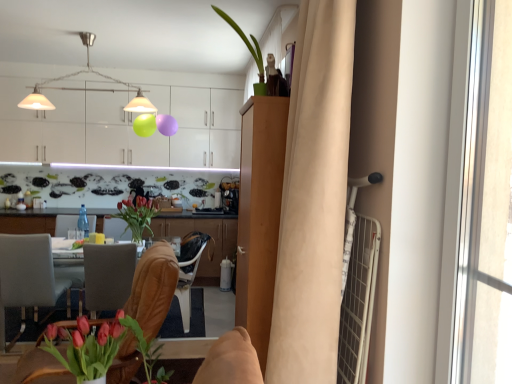
Find the location of a particular element. This screenshot has height=384, width=512. green matte plant at upper center is located at coordinates (250, 52).

What is the approximate height of matte glass vase at center, the 1th floral arrangement when ordered from back to front?

17.82 inches.

At what (x,y) coordinates should I click in order to perform the action: click on matte gray chair at lower left, the 2th chair in the front-to-back sequence. Please return your answer as a coordinate pair (x, y). Looking at the image, I should click on (28, 278).

Where is `leather at center, which is the first chair from front to back`? The image size is (512, 384). leather at center, which is the first chair from front to back is located at coordinates tap(153, 288).

Between point (38, 249) and point (148, 363), which one is positioned in front?

The point (148, 363) is more forward.

Who is smaller, matte gray chair at lower left, the 2th chair in the front-to-back sequence, or matte pink tulips in vase at lower left, the first floral arrangement positioned from the front?

matte pink tulips in vase at lower left, the first floral arrangement positioned from the front, is smaller.

Does matte gray chair at lower left, the 2th chair in the front-to-back sequence, turn towards matte pink tulips in vase at lower left, placed as the first floral arrangement when sorted from right to left?

No, matte gray chair at lower left, the 2th chair in the front-to-back sequence, is not facing towards matte pink tulips in vase at lower left, placed as the first floral arrangement when sorted from right to left.

From the image's perspective, which one is positioned lower, matte gray chair at lower left, positioned as the first chair in left-to-right order, or matte pink tulips in vase at lower left, positioned as the 2th floral arrangement in left-to-right order?

From the image's view, matte gray chair at lower left, positioned as the first chair in left-to-right order, is below.

Considering the positions of objects light brown wood cabinet at center, acting as the 1th cabinetry starting from the front, and beige fabric curtain at right in the image provided, who is in front, light brown wood cabinet at center, acting as the 1th cabinetry starting from the front, or beige fabric curtain at right?

beige fabric curtain at right is in front.

Based on the photo, is light brown wood cabinet at center, acting as the 1th cabinetry starting from the front, not close to beige fabric curtain at right?

No, there isn't a large distance between light brown wood cabinet at center, acting as the 1th cabinetry starting from the front, and beige fabric curtain at right.

From the image's perspective, would you say light brown wood cabinet at center, acting as the 1th cabinetry starting from the front, is positioned over beige fabric curtain at right?

Incorrect, from the image's perspective, light brown wood cabinet at center, acting as the 1th cabinetry starting from the front, is lower than beige fabric curtain at right.

Can you tell me how much light brown wood cabinet at center, the 3th cabinetry from the back, and beige fabric curtain at right differ in facing direction?

0.000154 degrees.

Find the location of a particular element. The image size is (512, 384). bottle behind the matte pink tulips in vase at lower left, placed as the first floral arrangement when sorted from right to left is located at coordinates (83, 221).

Is point (85, 217) less distant than point (113, 323)?

No, (85, 217) is further to viewer.

Which object is positioned more to the right, clear glass bottle at center or matte pink tulips in vase at lower left, which appears as the 1th floral arrangement when ordered from the bottom?

matte pink tulips in vase at lower left, which appears as the 1th floral arrangement when ordered from the bottom, is more to the right.

Is clear glass bottle at center facing towards matte pink tulips in vase at lower left, placed as the first floral arrangement when sorted from right to left?

No.

Is white glossy cabinets at upper center, the third cabinetry in the front-to-back sequence, not near clear glass bottle at center?

That's right, there is a large distance between white glossy cabinets at upper center, the third cabinetry in the front-to-back sequence, and clear glass bottle at center.

Is white glossy cabinets at upper center, arranged as the first cabinetry when viewed from the back, in front of or behind clear glass bottle at center in the image?

Clearly, white glossy cabinets at upper center, arranged as the first cabinetry when viewed from the back, is behind clear glass bottle at center.

Considering the sizes of objects white glossy cabinets at upper center, the third cabinetry in the front-to-back sequence, and clear glass bottle at center in the image provided, who is taller, white glossy cabinets at upper center, the third cabinetry in the front-to-back sequence, or clear glass bottle at center?

white glossy cabinets at upper center, the third cabinetry in the front-to-back sequence.

From the image's perspective, count 1st cabinetrys upward from the matte brown cabinets at center, which is the 2th cabinetry in front-to-back order, and point to it. Please provide its 2D coordinates.

[(259, 215)]

From the image's perspective, is matte brown cabinets at center, which is the 2th cabinetry in front-to-back order, on top of light brown wood cabinet at center, acting as the 1th cabinetry starting from the front?

No.

Does point (33, 224) lie in front of point (254, 292)?

That is False.

Is matte brown cabinets at center, which is the 2th cabinetry in front-to-back order, inside or outside of light brown wood cabinet at center, the 3th cabinetry from the back?

matte brown cabinets at center, which is the 2th cabinetry in front-to-back order, exists outside the volume of light brown wood cabinet at center, the 3th cabinetry from the back.

Which object is further away from the camera taking this photo, clear glass bottle at center or matte gray chair at lower left, the 2th chair in the front-to-back sequence?

clear glass bottle at center is behind.

Considering the relative positions of clear glass bottle at center and matte gray chair at lower left, arranged as the 1th chair when viewed from the back, in the image provided, is clear glass bottle at center to the left or to the right of matte gray chair at lower left, arranged as the 1th chair when viewed from the back,?

In the image, clear glass bottle at center appears on the right side of matte gray chair at lower left, arranged as the 1th chair when viewed from the back.

Is clear glass bottle at center placed right next to matte gray chair at lower left, the 2th chair when ordered from right to left?

No, clear glass bottle at center is not making contact with matte gray chair at lower left, the 2th chair when ordered from right to left.

From a real-world perspective, which is physically above, clear glass bottle at center or matte gray chair at lower left, arranged as the 1th chair when viewed from the back?

clear glass bottle at center, from a real-world perspective.

Is clear glass bottle at center facing towards matte white coffee cup at center?

No, clear glass bottle at center is not aimed at matte white coffee cup at center.

Is clear glass bottle at center next to matte white coffee cup at center?

No, clear glass bottle at center is not touching matte white coffee cup at center.

Which object is further away from the camera, clear glass bottle at center or matte white coffee cup at center?

clear glass bottle at center is behind.

At what (x,y) coordinates should I click in order to perform the action: click on coffee cup lying below the clear glass bottle at center (from the image's perspective). Please return your answer as a coordinate pair (x, y). Looking at the image, I should click on (72, 234).

In order to click on floral arrangement in front of the matte gray chair at lower left, the 2th chair in the front-to-back sequence in this screenshot , I will do `click(101, 348)`.

This screenshot has width=512, height=384. Identify the location of the 1st cabinetry counting from the left of the beige fabric curtain at right. [259, 215].

Estimate the real-world distances between objects in this image. Which object is further from green matte plant at upper center, matte pink tulips in vase at lower left, positioned as the second floral arrangement in top-to-bottom order, or beige fabric curtain at right?

Based on the image, matte pink tulips in vase at lower left, positioned as the second floral arrangement in top-to-bottom order, appears to be further to green matte plant at upper center.

Considering their positions, is light brown wood cabinet at center, acting as the 1th cabinetry starting from the front, positioned closer to green matte plant at lower center than metallic pendant lights at upper center?

light brown wood cabinet at center, acting as the 1th cabinetry starting from the front, lies closer to green matte plant at lower center than the other object.

Based on the photo, when comparing their distances from clear glass bottle at center, does green matte plant at upper center or light brown wood cabinet at center, acting as the 1th cabinetry starting from the front, seem further?

Among the two, green matte plant at upper center is located further to clear glass bottle at center.

When comparing their distances from beige fabric curtain at right, does matte white coffee cup at center or clear glass bottle at center seem closer?

The object closer to beige fabric curtain at right is clear glass bottle at center.

Looking at the image, which one is located closer to matte gray chair at lower left, the 2th chair in the front-to-back sequence, light brown wood cabinet at center, the 3th cabinetry from the back, or matte glass vase at center, positioned as the 2th floral arrangement in right-to-left order?

matte glass vase at center, positioned as the 2th floral arrangement in right-to-left order.

Considering their positions, is green matte plant at upper center positioned further to matte white coffee cup at center than leather at center, which ranks as the second chair in back-to-front order?

Among the two, green matte plant at upper center is located further to matte white coffee cup at center.

Based on their spatial positions, is green matte plant at upper center or matte pink tulips in vase at lower left, placed as the first floral arrangement when sorted from right to left, further from matte gray chair at lower left, the 2th chair in the front-to-back sequence?

Based on the image, green matte plant at upper center appears to be further to matte gray chair at lower left, the 2th chair in the front-to-back sequence.

Looking at the image, which one is located further to matte brown cabinets at center, which is the 2th cabinetry in front-to-back order, matte glass vase at center, which is counted as the 1th floral arrangement, starting from the top, or metallic pendant lights at upper center?

metallic pendant lights at upper center.

This screenshot has height=384, width=512. I want to click on floral arrangement positioned between green matte plant at lower center and matte white coffee cup at center from near to far, so click(137, 216).

Locate an element on the screen. floral arrangement between metallic pendant lights at upper center and matte white coffee cup at center vertically is located at coordinates (137, 216).

The width and height of the screenshot is (512, 384). What are the coordinates of `cabinetry between green matte plant at upper center and metallic pendant lights at upper center along the z-axis` in the screenshot? It's located at (259, 215).

This screenshot has width=512, height=384. Find the location of `cabinetry located between matte pink tulips in vase at lower left, which appears as the 1th floral arrangement when ordered from the bottom, and metallic pendant lights at upper center in the depth direction`. cabinetry located between matte pink tulips in vase at lower left, which appears as the 1th floral arrangement when ordered from the bottom, and metallic pendant lights at upper center in the depth direction is located at coordinates (259, 215).